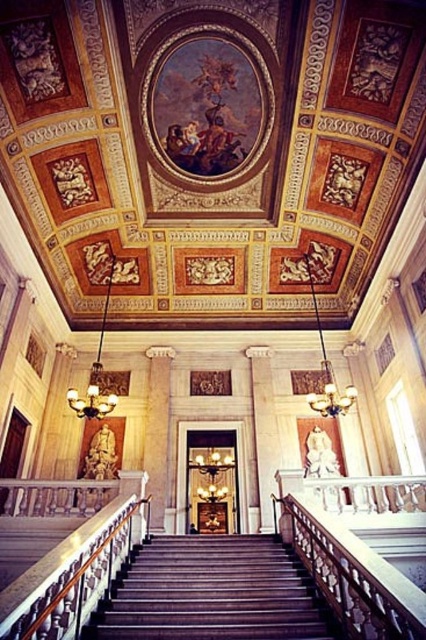
You are an architect examining the grand staircase and its surroundings. You notice the white marble railing at center. Based on its position, can you determine if it is closer to the staircase or the walls?

The white marble railing at center is located at point coordinates that place it closer to the staircase than the walls, as its position is centrally positioned along the staircase structure.

You are standing at the entrance of the grand hall and want to ascend the wooden staircase at center. Based on its position coordinates, can you determine if the staircase is directly in front of you or slightly to one side?

The wooden staircase at center is positioned at coordinates point (213, 593), which means it is slightly to the right of the central axis. Therefore, the staircase is not directly in front but slightly to the right side.

You are an interior designer planning to install a chandelier above the wooden staircase at center and the white marble column at center. Which object requires a larger chandelier to maintain visual balance?

The white marble column at center requires a larger chandelier because it is larger than the wooden staircase at center, so a proportionally bigger chandelier would balance its size.